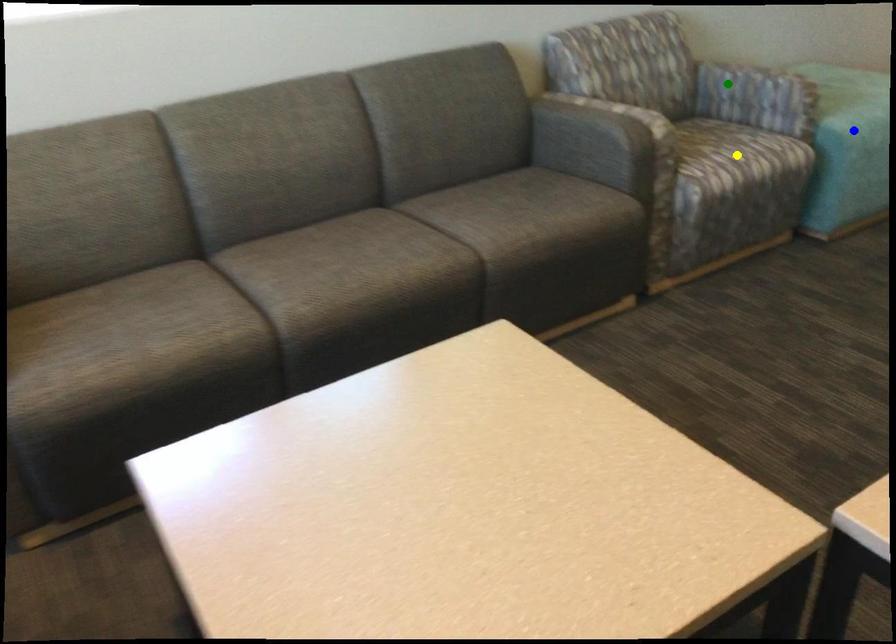
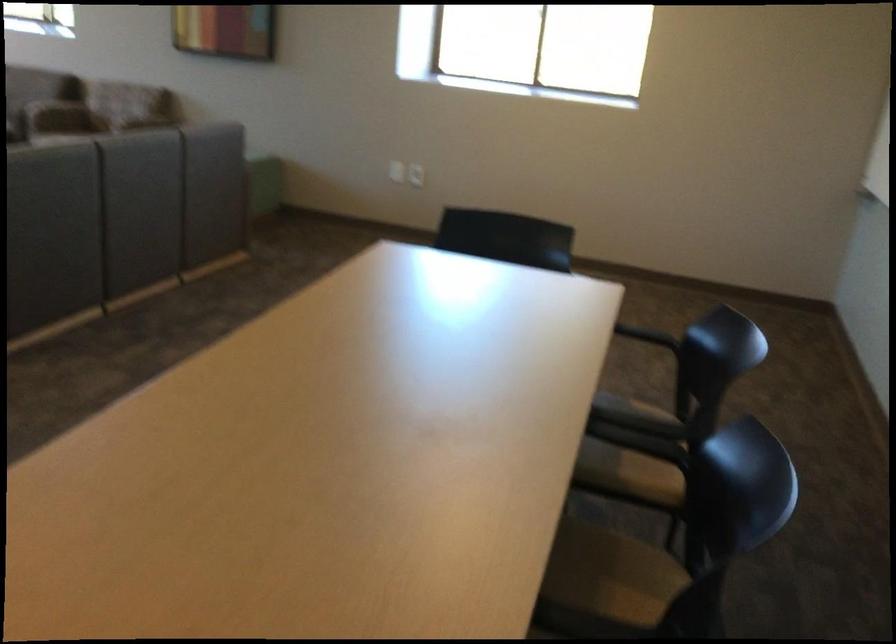
I am providing you with two images of the same scene from different viewpoints. Three points are marked in image1. Which point corresponds to a part or object that is occluded in image2?In image1, three points are marked. Which of them correspond to a part or object that is occluded in image2?Among the three points shown in image1, which one corresponds to a part or object that is no longer visible due to occlusion in image2?

Invisible in image2: yellow point, green point, blue point.